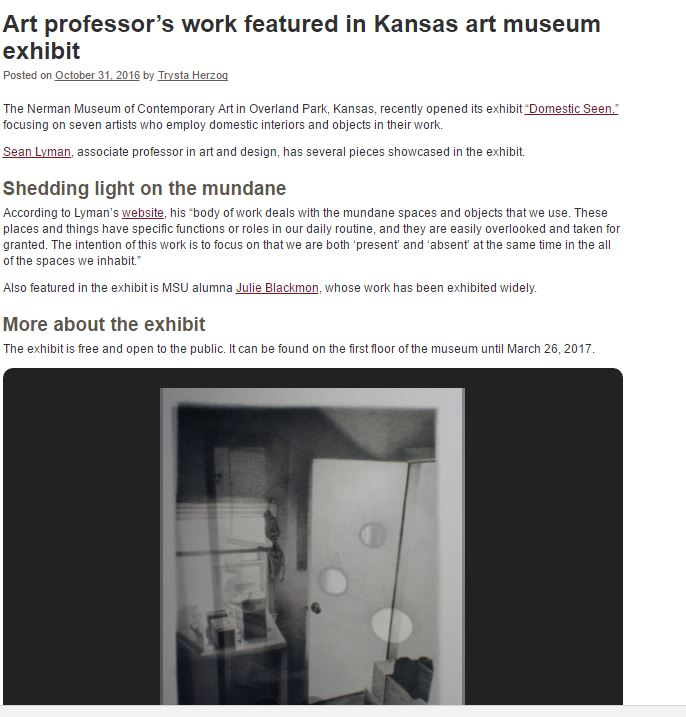
At what (x,y) coordinates should I click in order to perform the action: click on door. Please return your answer as a coordinate pair (x, y). The width and height of the screenshot is (686, 717). Looking at the image, I should click on coord(338,500).